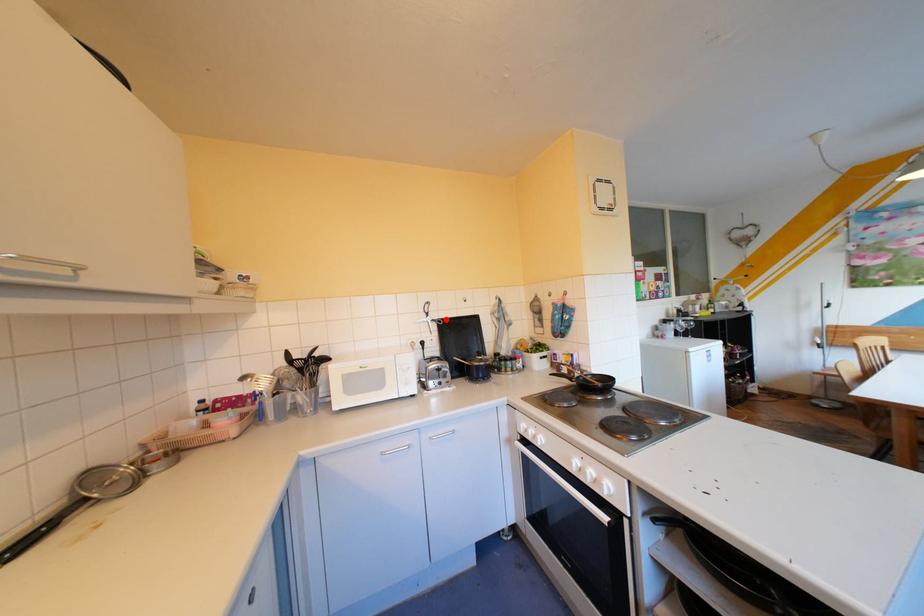
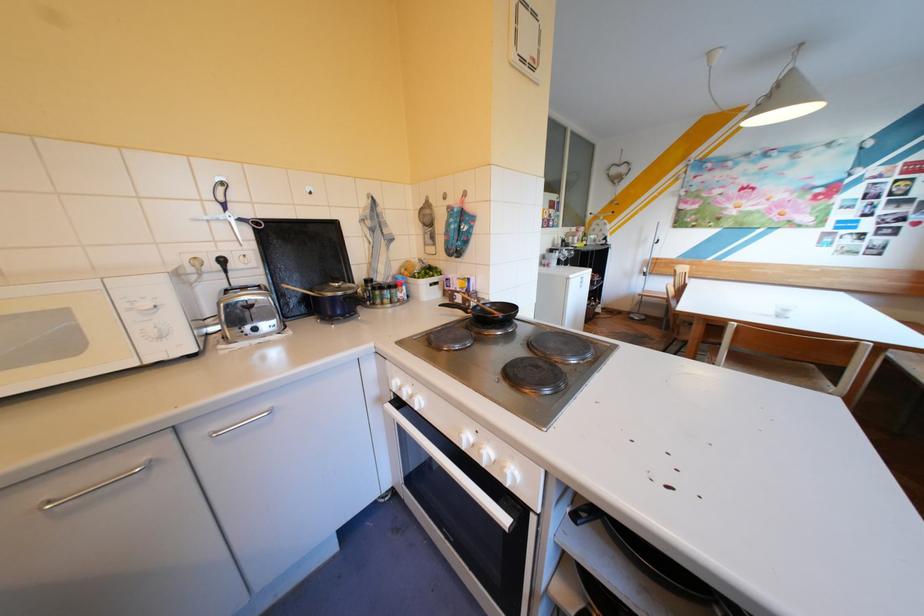
Find the pixel in the second image that matches the highlighted location in the first image.

(253, 219)